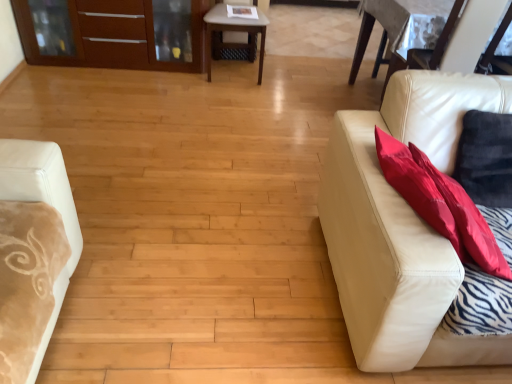
At what (x,y) coordinates should I click in order to perform the action: click on free space that is in between light brown wooden table at center and matte wood dresser at upper left. Please return your answer as a coordinate pair (x, y). Looking at the image, I should click on (130, 74).